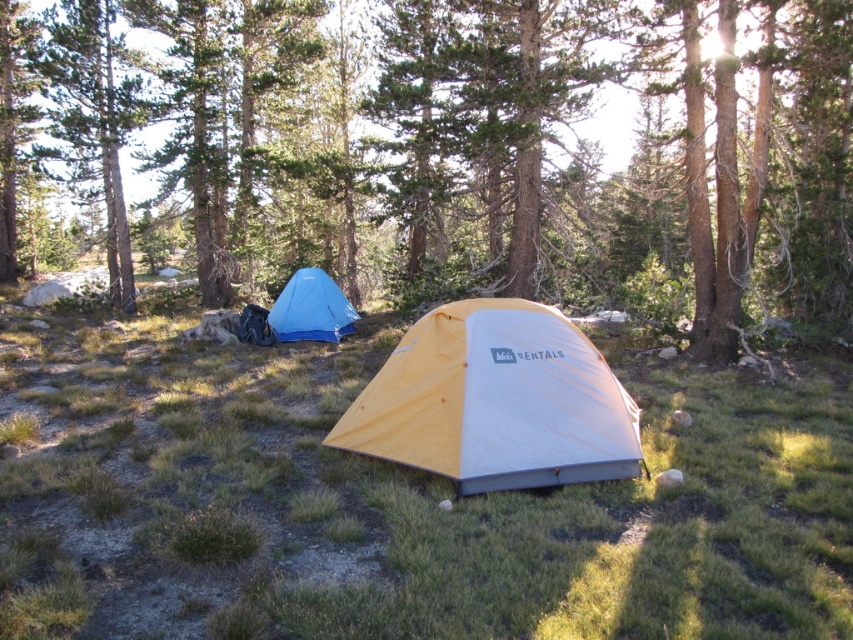
Question: Considering the relative positions of brown textured tree at center and yellow fabric tent at center in the image provided, where is brown textured tree at center located with respect to yellow fabric tent at center?

Choices:
 (A) left
 (B) right

Answer: (B)

Question: Which is farther from the yellow fabric tent at center?

Choices:
 (A) green grass at center
 (B) blue tarp at center
 (C) brown textured tree at center

Answer: (C)

Question: Is green grass at center thinner than yellow fabric tent at center?

Choices:
 (A) yes
 (B) no

Answer: (B)

Question: Is brown textured tree at center bigger than green grass at center?

Choices:
 (A) yes
 (B) no

Answer: (A)

Question: Which is farther from the green grass at center?

Choices:
 (A) brown textured tree at center
 (B) yellow fabric tent at center
 (C) blue tarp at center

Answer: (A)

Question: Which object is the closest to the green grass at center?

Choices:
 (A) blue tarp at center
 (B) yellow fabric tent at center

Answer: (B)